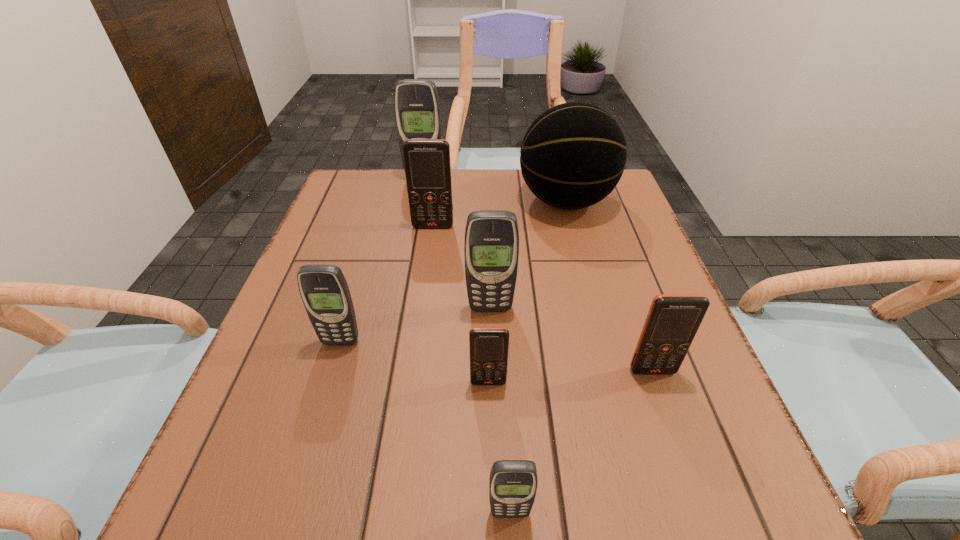
Find the location of a particular element. the second gray cellular telephone from left to right is located at coordinates (417, 109).

Locate an element on the screen. the farthest cellular telephone is located at coordinates (417, 109).

At what (x,y) coordinates should I click in order to perform the action: click on basketball. Please return your answer as a coordinate pair (x, y). This screenshot has width=960, height=540. Looking at the image, I should click on (573, 155).

The image size is (960, 540). I want to click on the farthest orange cellular telephone, so pos(427,164).

You are a GUI agent. You are given a task and a screenshot of the screen. Output one action in this format:
    pyautogui.click(x=<x>, y=<y>)
    Task: Click on the sixth nearest cellular telephone
    The width and height of the screenshot is (960, 540).
    Given the screenshot: What is the action you would take?
    pyautogui.click(x=427, y=164)

Find the location of `the second biggest gray cellular telephone`. the second biggest gray cellular telephone is located at coordinates (491, 248).

You are a GUI agent. You are given a task and a screenshot of the screen. Output one action in this format:
    pyautogui.click(x=<x>, y=<y>)
    Task: Click on the fifth nearest object
    This screenshot has height=540, width=960.
    Given the screenshot: What is the action you would take?
    point(491,248)

The image size is (960, 540). In order to click on the leftmost object in this screenshot , I will do `click(324, 290)`.

Locate an element on the screen. The width and height of the screenshot is (960, 540). the leftmost gray cellular telephone is located at coordinates (324, 290).

Find the location of `the rightmost cellular telephone`. the rightmost cellular telephone is located at coordinates (673, 320).